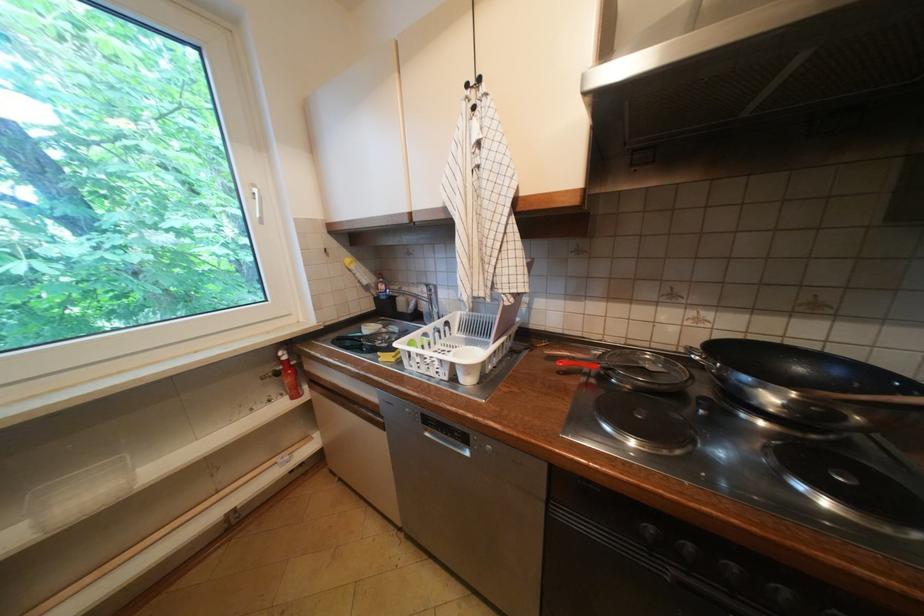
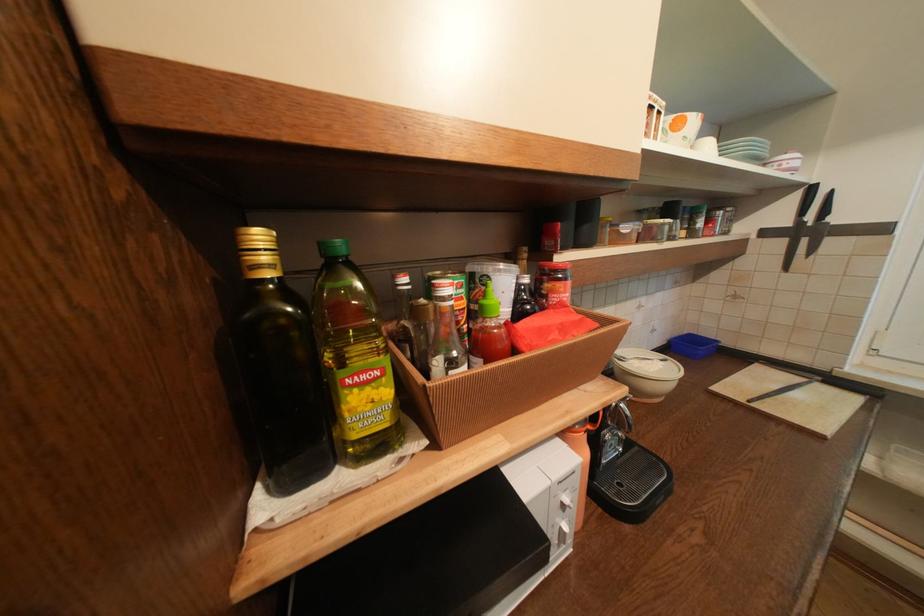
How did the camera likely rotate?

The camera's rotation is toward left-down.